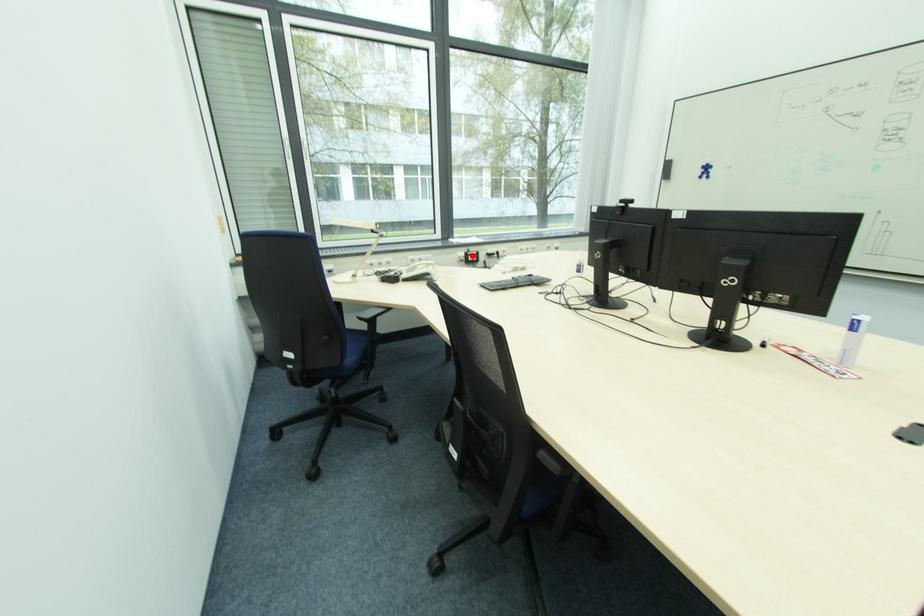
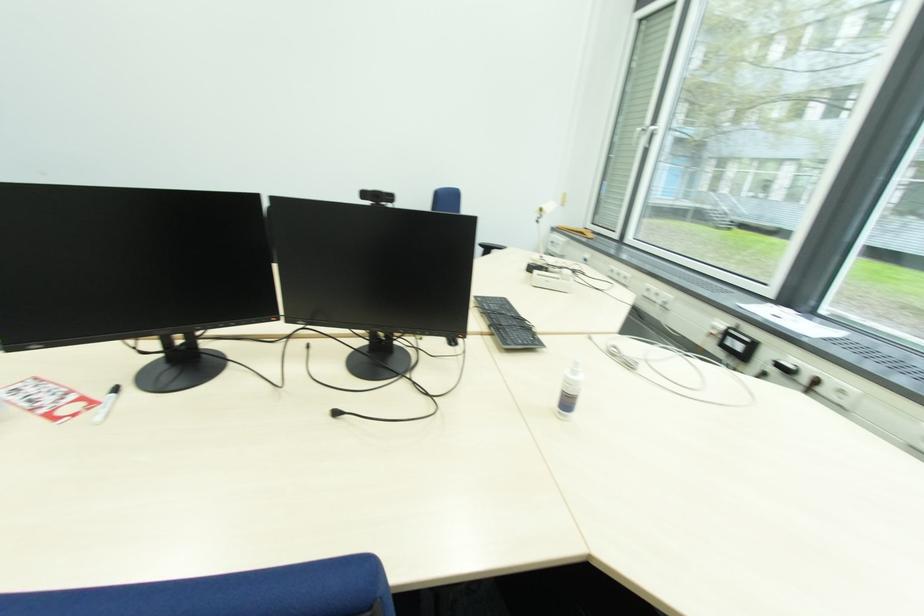
The point at the highlighted location is marked in the first image. Where is the corresponding point in the second image?

(734, 333)